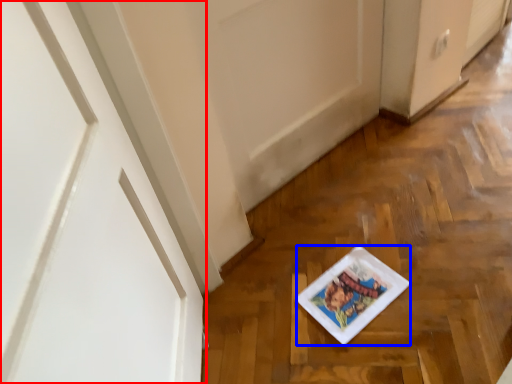
Question: Among these objects, which one is nearest to the camera, door (highlighted by a red box) or platter (highlighted by a blue box)?

Choices:
 (A) door
 (B) platter

Answer: (A)